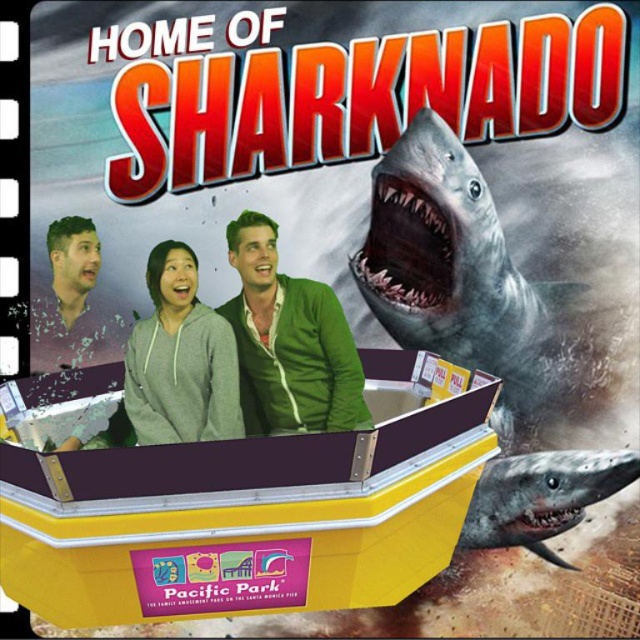
You are designing a new exhibit for Pacific Park and need to ensure that the gray fleece sweatshirt at center and the matte gray hoodie at center can be displayed side by side without overlapping. Given their sizes, which one should be placed first to accommodate both?

The gray fleece sweatshirt at center is bigger than the matte gray hoodie at center, so place the gray fleece sweatshirt at center first to ensure there is enough space for both.

You are designing a promotional poster for the new attraction and need to ensure proper spacing between the gray textured shark at right and the green cardigan at center. According to the spatial details provided, which object is wider and should be given more horizontal space?

The gray textured shark at right is wider than the green cardigan at center, so it should be given more horizontal space to accommodate its width.